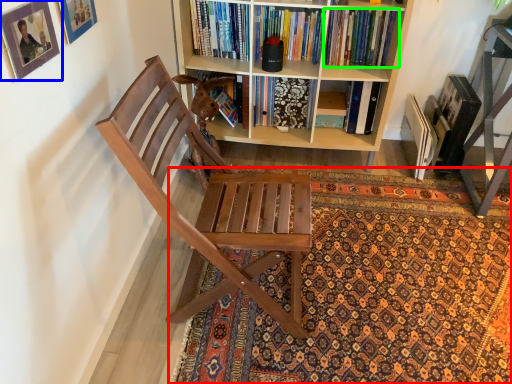
Question: Based on their relative distances, which object is farther from mat (highlighted by a red box)? Choose from picture frame (highlighted by a blue box) and book (highlighted by a green box).

Choices:
 (A) picture frame
 (B) book

Answer: (A)